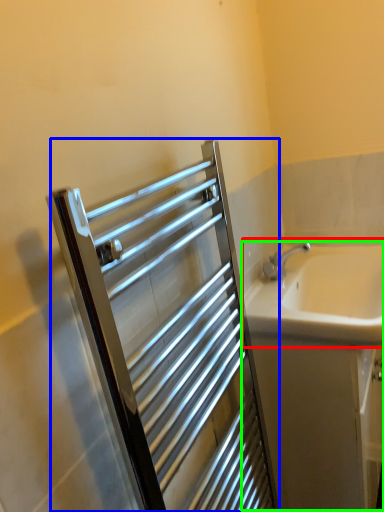
Question: Which is farther away from sink (highlighted by a red box)? screen door (highlighted by a blue box) or bath (highlighted by a green box)?

Choices:
 (A) screen door
 (B) bath

Answer: (A)